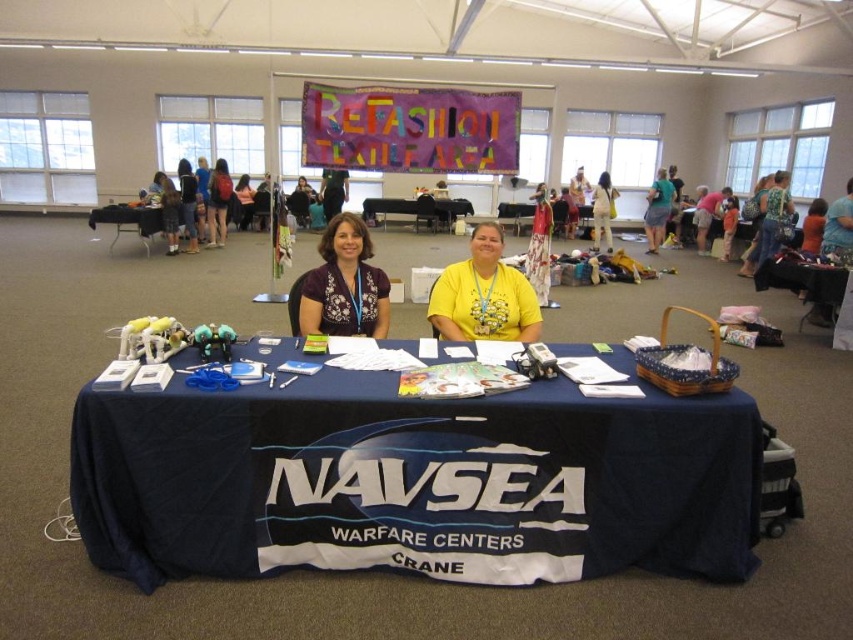
Is point (703, 548) positioned before point (225, 180)?

Yes, it is.

Who is positioned more to the left, blue fabric table at center or matte black backpack at center?

From the viewer's perspective, matte black backpack at center appears more on the left side.

Between point (459, 518) and point (218, 209), which one is positioned behind?

Point (218, 209)

The height and width of the screenshot is (640, 853). Find the location of `blue fabric table at center`. blue fabric table at center is located at coordinates (415, 481).

Is point (223, 232) farther from viewer compared to point (608, 182)?

That is False.

Is matte black backpack at center smaller than white cotton dress at upper center?

Incorrect, matte black backpack at center is not smaller in size than white cotton dress at upper center.

Who is more forward, (215, 202) or (606, 230)?

Point (215, 202)

This screenshot has width=853, height=640. Find the location of `matte black backpack at center`. matte black backpack at center is located at coordinates (218, 202).

Between matte purple blouse at center and matte green skirt at center, which one has less height?

matte purple blouse at center is shorter.

Does matte purple blouse at center have a lesser height compared to matte green skirt at center?

Yes, matte purple blouse at center is shorter than matte green skirt at center.

The width and height of the screenshot is (853, 640). I want to click on matte purple blouse at center, so click(344, 284).